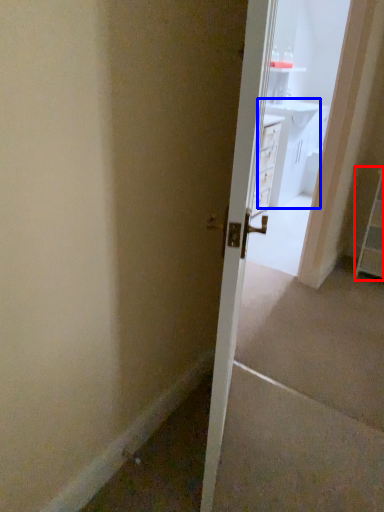
Question: Which point is further to the camera, dresser (highlighted by a red box) or vanity (highlighted by a blue box)?

Choices:
 (A) dresser
 (B) vanity

Answer: (B)